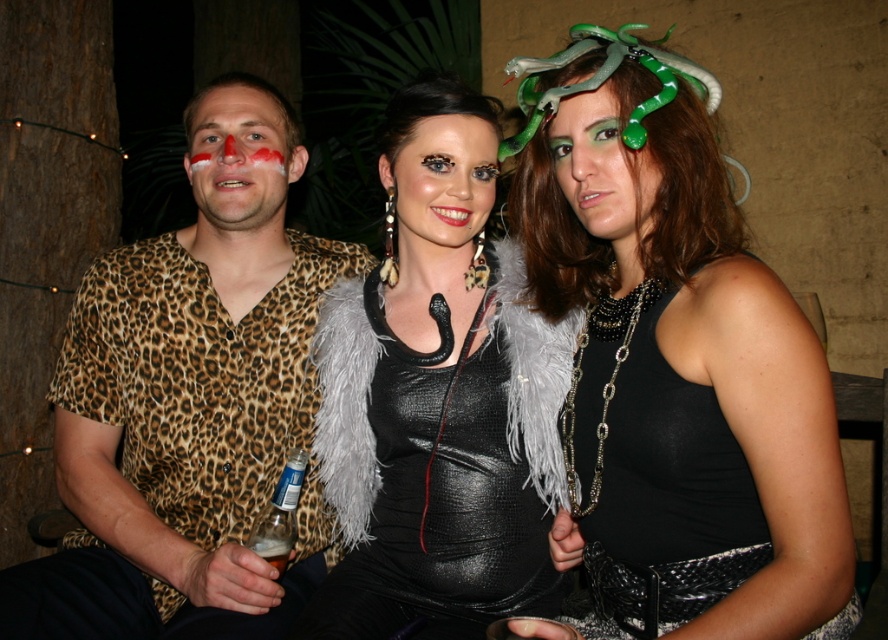
Question: Is shiny black tank top at center below matte leopard print shirt at left?

Choices:
 (A) no
 (B) yes

Answer: (B)

Question: Is shiny black leather face at center smaller than matte leopard print shirt at left?

Choices:
 (A) yes
 (B) no

Answer: (A)

Question: Which object is farther from the camera taking this photo?

Choices:
 (A) translucent plastic bottle at lower left
 (B) matte leopard print shirt at left
 (C) leopard print shirt at left
 (D) black leather dress at center

Answer: (B)

Question: Which point is farther to the camera?

Choices:
 (A) (672, 353)
 (B) (279, 552)
 (C) (458, 124)
 (D) (504, 552)

Answer: (C)

Question: Does black leather dress at center appear on the left side of translucent plastic bottle at lower left?

Choices:
 (A) yes
 (B) no

Answer: (B)

Question: Which point is farther to the camera?

Choices:
 (A) shiny black tank top at center
 (B) matte leopard print shirt at left
 (C) translucent plastic bottle at lower left

Answer: (B)